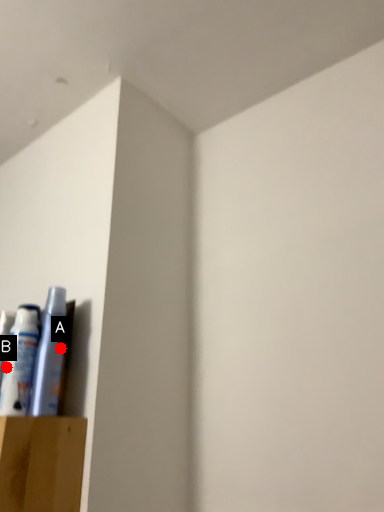
Question: Two points are circled on the image, labeled by A and B beside each circle. Which point is farther to the camera?

Choices:
 (A) A is further
 (B) B is further

Answer: (A)